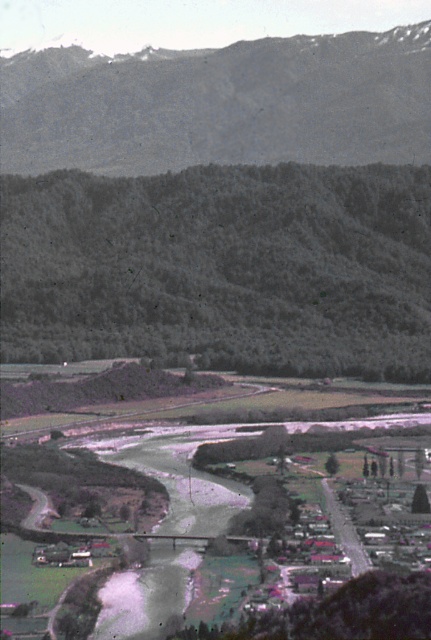
Image resolution: width=431 pixels, height=640 pixels. What do you see at coordinates (221, 268) in the screenshot?
I see `dark green forested hillside at center` at bounding box center [221, 268].

At what (x,y) coordinates should I click in order to perform the action: click on dark green forested hillside at center. Please return your answer as a coordinate pair (x, y). Image resolution: width=431 pixels, height=640 pixels. Looking at the image, I should click on (221, 268).